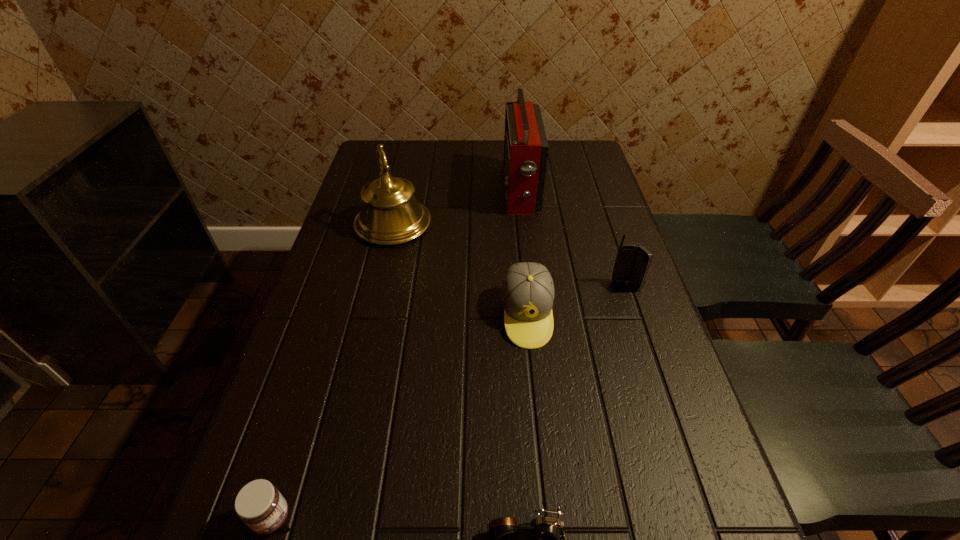
Where is `radio receiver`? The width and height of the screenshot is (960, 540). radio receiver is located at coordinates (526, 147).

The width and height of the screenshot is (960, 540). In order to click on bell in this screenshot , I will do `click(390, 215)`.

Locate an element on the screen. This screenshot has width=960, height=540. the rightmost object is located at coordinates (632, 263).

Locate an element on the screen. The image size is (960, 540). the third tallest object is located at coordinates (632, 263).

The image size is (960, 540). What are the coordinates of `baseball cap` in the screenshot? It's located at (527, 294).

Locate an element on the screen. The width and height of the screenshot is (960, 540). the fifth tallest object is located at coordinates (259, 504).

The width and height of the screenshot is (960, 540). I want to click on vacant space situated 0.380m on the front-facing side of the radio receiver, so click(x=378, y=190).

The width and height of the screenshot is (960, 540). I want to click on free space located 0.200m on the front-facing side of the radio receiver, so tap(437, 190).

Where is `free space located on the front-facing side of the radio receiver`? The height and width of the screenshot is (540, 960). free space located on the front-facing side of the radio receiver is located at coordinates (378, 190).

Identify the location of free location located 0.320m on the front of the bell. This screenshot has width=960, height=540. (365, 348).